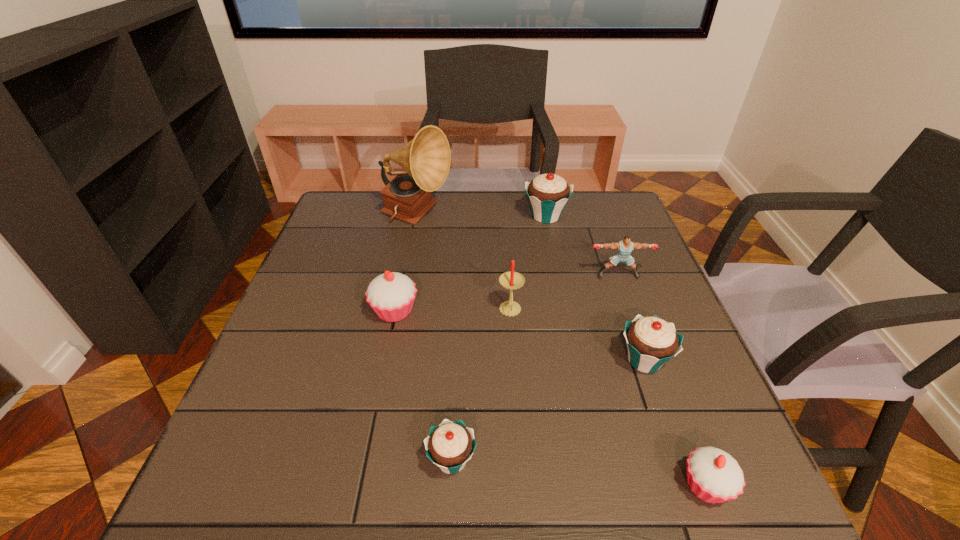
This screenshot has height=540, width=960. I want to click on phonograph record, so click(426, 158).

The width and height of the screenshot is (960, 540). I want to click on the second teal cupcake from right to left, so click(x=548, y=194).

Where is `the tallest cupcake`? This screenshot has height=540, width=960. the tallest cupcake is located at coordinates (548, 194).

Where is `candle`? candle is located at coordinates (511, 280).

Locate an element on the screen. The height and width of the screenshot is (540, 960). puncher is located at coordinates (624, 247).

You are a GUI agent. You are given a task and a screenshot of the screen. Output one action in this format:
    pyautogui.click(x=<x>, y=<y>)
    Task: Click on the red puncher
    
    Given the screenshot: What is the action you would take?
    pyautogui.click(x=624, y=247)

You are a GUI agent. You are given a task and a screenshot of the screen. Output one action in this format:
    pyautogui.click(x=<x>, y=<y>)
    Task: Click on the bigger pink cupcake
    The image size is (960, 540).
    Given the screenshot: What is the action you would take?
    pyautogui.click(x=391, y=295)

Locate an element on the screen. The image size is (960, 540). the leftmost cupcake is located at coordinates (391, 295).

Where is `the third nearest cupcake`? the third nearest cupcake is located at coordinates (651, 342).

At what (x,y) coordinates should I click in order to perform the action: click on the sixth farthest object. Please return your answer as a coordinate pair (x, y). Looking at the image, I should click on (651, 342).